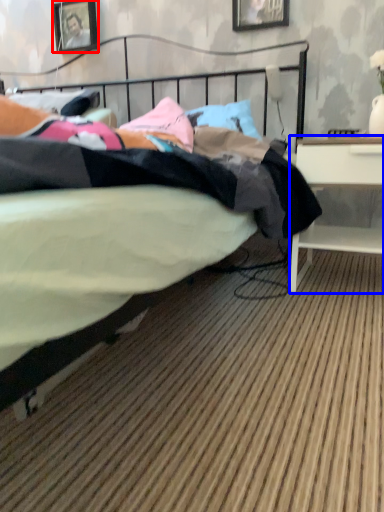
Question: Which point is further to the camera, picture frame (highlighted by a red box) or desk (highlighted by a blue box)?

Choices:
 (A) picture frame
 (B) desk

Answer: (A)